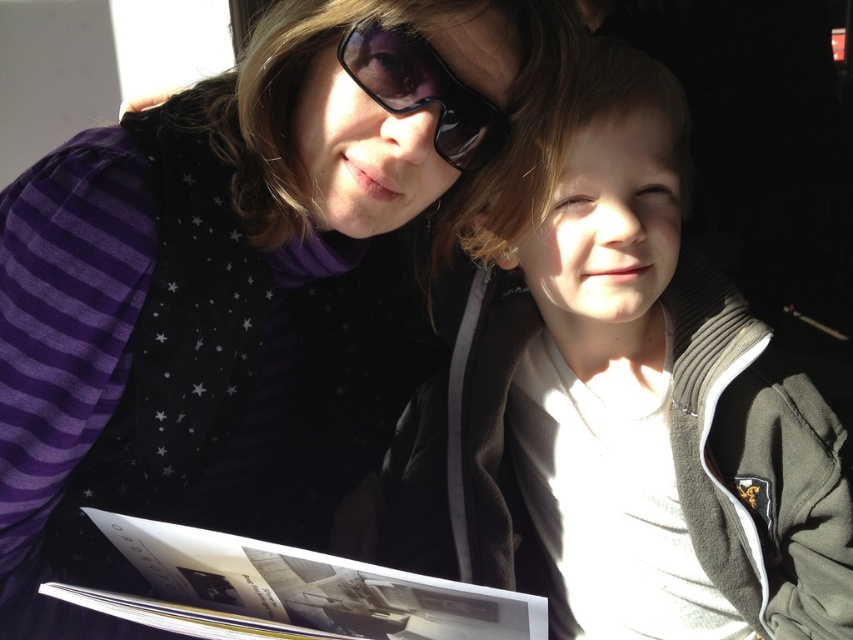
Question: From the image, what is the correct spatial relationship of matte black sweater at upper center in relation to light brown hair at center?

Choices:
 (A) above
 (B) below

Answer: (A)

Question: Which point is closer to the camera?

Choices:
 (A) (434, 406)
 (B) (173, 157)

Answer: (B)

Question: Which of the following is the closest to the observer?

Choices:
 (A) light brown hair at center
 (B) matte black sunglasses at upper center
 (C) matte black sweater at upper center

Answer: (C)

Question: Estimate the real-world distances between objects in this image. Which object is farther from the matte black sunglasses at upper center?

Choices:
 (A) matte black sweater at upper center
 (B) light brown hair at center

Answer: (B)

Question: Can you confirm if light brown hair at center is positioned to the right of matte black sunglasses at upper center?

Choices:
 (A) no
 (B) yes

Answer: (B)

Question: Is matte black sweater at upper center bigger than light brown hair at center?

Choices:
 (A) yes
 (B) no

Answer: (A)